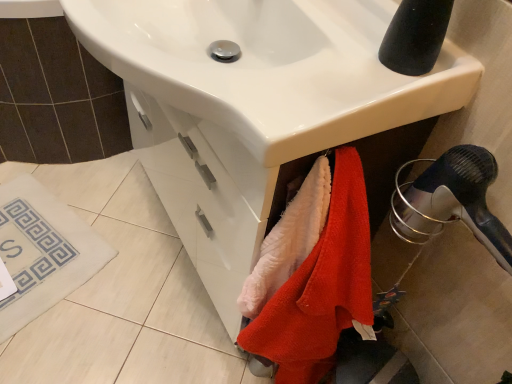
Identify the location of free point in front of black rubber tap at upper right. coord(369,99).